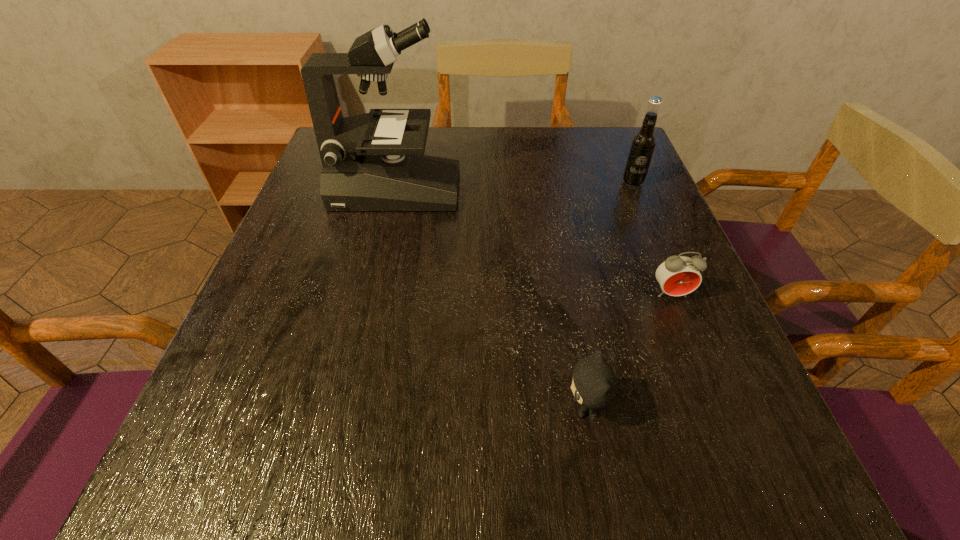
Identify the location of the tallest object. The width and height of the screenshot is (960, 540). (375, 161).

Where is `the leftmost object`? The width and height of the screenshot is (960, 540). the leftmost object is located at coordinates (375, 161).

Locate an element on the screen. the second tallest object is located at coordinates (642, 147).

You are a GUI agent. You are given a task and a screenshot of the screen. Output one action in this format:
    pyautogui.click(x=<x>, y=<y>)
    Task: Click on the alarm clock
    This screenshot has height=540, width=960.
    Given the screenshot: What is the action you would take?
    pyautogui.click(x=678, y=275)

Locate an element on the screen. the nearest object is located at coordinates (594, 385).

Locate an element on the screen. This screenshot has width=960, height=540. the third object from right to left is located at coordinates (594, 385).

Find the location of `vacant space situated through the eyepieces of the tallest object`. vacant space situated through the eyepieces of the tallest object is located at coordinates (613, 190).

The width and height of the screenshot is (960, 540). Find the location of `free space located on the label of the third shortest object`. free space located on the label of the third shortest object is located at coordinates (670, 273).

I want to click on vacant space located on the face of the alarm clock, so click(x=714, y=403).

The image size is (960, 540). I want to click on free space located on the front-facing side of the kitten, so click(x=331, y=408).